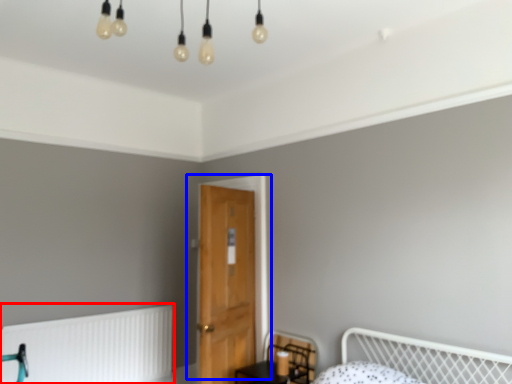
Question: Which point is further to the camera, radiator (highlighted by a red box) or door (highlighted by a blue box)?

Choices:
 (A) radiator
 (B) door

Answer: (A)